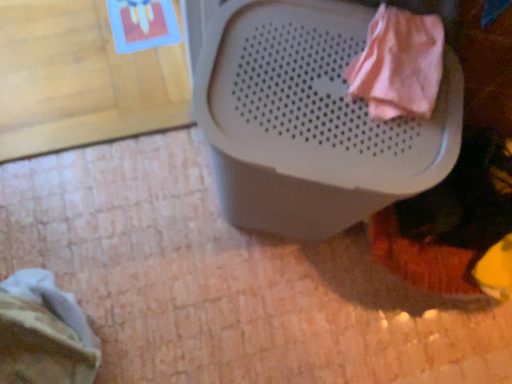
The width and height of the screenshot is (512, 384). Identify the location of free area in between white plastic waste container at upper center and striped fabric at lower left, marked as the 1th clothing in a back-to-front arrangement. (183, 273).